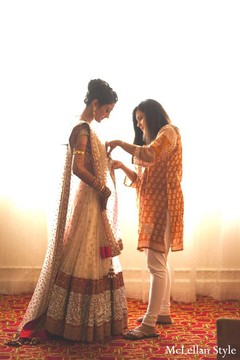
You are a GUI agent. You are given a task and a screenshot of the screen. Output one action in this format:
    pyautogui.click(x=<x>, y=<y>)
    Task: Click on the white baseboard
    The width and height of the screenshot is (240, 360).
    Given the screenshot: What is the action you would take?
    pyautogui.click(x=17, y=283)